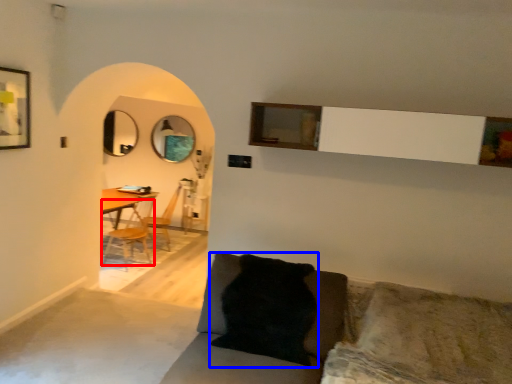
Question: Among these objects, which one is farthest to the camera, chair (highlighted by a red box) or pillow (highlighted by a blue box)?

Choices:
 (A) chair
 (B) pillow

Answer: (A)